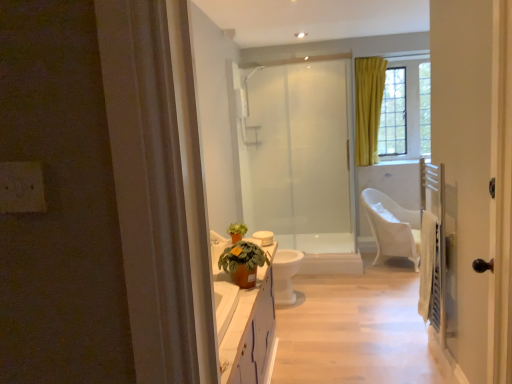
Describe the element at coordinates (475, 176) in the screenshot. I see `white glossy door at right` at that location.

The width and height of the screenshot is (512, 384). What do you see at coordinates (392, 227) in the screenshot? I see `white plastic chair at right` at bounding box center [392, 227].

This screenshot has height=384, width=512. Describe the element at coordinates (302, 161) in the screenshot. I see `frosted glass shower door at center` at that location.

Find the location of a particular element. Image resolution: width=512 pixels, height=384 pixels. white glossy door at right is located at coordinates (475, 176).

From the image's perspective, is yellow fabric curtain at upper right above terracotta clay pot at center?

Indeed, from the image's perspective, yellow fabric curtain at upper right is shown above terracotta clay pot at center.

In the scene shown: From a real-world perspective, between yellow fabric curtain at upper right and terracotta clay pot at center, who is vertically higher?

yellow fabric curtain at upper right, from a real-world perspective.

Which of these two, yellow fabric curtain at upper right or terracotta clay pot at center, is thinner?

With smaller width is yellow fabric curtain at upper right.

Is terracotta clay pot at center aimed at frosted glass shower door at center?

No, terracotta clay pot at center is not oriented towards frosted glass shower door at center.

Considering the sizes of objects terracotta clay pot at center and frosted glass shower door at center in the image provided, who is shorter, terracotta clay pot at center or frosted glass shower door at center?

With less height is terracotta clay pot at center.

Looking at this image, is there a large distance between terracotta clay pot at center and frosted glass shower door at center?

Yes.

From the image's perspective, between terracotta clay pot at center and frosted glass shower door at center, which one is located above?

frosted glass shower door at center is shown above in the image.

Based on the photo, is white glossy toilet bowl at center facing towards yellow fabric curtain at upper right?

No, white glossy toilet bowl at center is not oriented towards yellow fabric curtain at upper right.

Is white glossy toilet bowl at center far away from yellow fabric curtain at upper right?

Yes, white glossy toilet bowl at center is far from yellow fabric curtain at upper right.

Which is correct: white glossy toilet bowl at center is inside yellow fabric curtain at upper right, or outside of it?

The correct answer is: outside.

Considering the relative sizes of white glossy toilet bowl at center and yellow fabric curtain at upper right in the image provided, is white glossy toilet bowl at center wider than yellow fabric curtain at upper right?

Correct, the width of white glossy toilet bowl at center exceeds that of yellow fabric curtain at upper right.

From a real-world perspective, does white plastic chair at right sit lower than yellow fabric curtain at upper right?

Yes, from a real-world perspective, white plastic chair at right is below yellow fabric curtain at upper right.

In the scene shown: Is white plastic chair at right touching yellow fabric curtain at upper right?

white plastic chair at right and yellow fabric curtain at upper right are not in contact.

Can you confirm if white plastic chair at right is positioned to the right of yellow fabric curtain at upper right?

No.

Is frosted glass shower door at center taller than white plastic chair at right?

Yes.

From the image's perspective, which object appears higher, frosted glass shower door at center or white plastic chair at right?

frosted glass shower door at center appears higher in the image.

This screenshot has width=512, height=384. I want to click on screen door on the left of the white plastic chair at right, so click(302, 161).

Is white plastic chair at right a part of yellow fabric curtain at upper right?

That's incorrect, white plastic chair at right is not inside yellow fabric curtain at upper right.

The image size is (512, 384). Find the location of `chair below the yellow fabric curtain at upper right (from the image's perspective)`. chair below the yellow fabric curtain at upper right (from the image's perspective) is located at coordinates (392, 227).

Would you say yellow fabric curtain at upper right is to the left or to the right of white plastic chair at right in the picture?

yellow fabric curtain at upper right is positioned on white plastic chair at right's right side.

Between point (403, 244) and point (286, 264), which one is positioned behind?

The point (403, 244) is farther from the camera.

From the image's perspective, is white plastic chair at right above or below white glossy toilet bowl at center?

Clearly, from the image's perspective, white plastic chair at right is above white glossy toilet bowl at center.

Choose the correct answer: Is white plastic chair at right inside white glossy toilet bowl at center or outside it?

white plastic chair at right cannot be found inside white glossy toilet bowl at center.

Find the location of a particular element. window above the terracotta clay pot at center (from the image's perspective) is located at coordinates (406, 112).

You are a GUI agent. You are given a task and a screenshot of the screen. Output one action in this format:
    pyautogui.click(x=<x>, y=<y>)
    Task: Click on the houseplant that is on the left side of frosted glass shower door at center
    This screenshot has width=512, height=384.
    Given the screenshot: What is the action you would take?
    243,263

Which object lies further to the anchor point white glossy toilet bowl at center, frosted glass shower door at center or terracotta clay pot at center?

Among the two, terracotta clay pot at center is located further to white glossy toilet bowl at center.

Considering their positions, is frosted glass shower door at center positioned further to yellow fabric curtain at upper right than white glossy toilet bowl at center?

Based on the image, white glossy toilet bowl at center appears to be further to yellow fabric curtain at upper right.

Which object lies nearer to the anchor point white glossy toilet bowl at center, white glossy door at right or white plastic chair at right?

white plastic chair at right is positioned closer to the anchor white glossy toilet bowl at center.

Estimate the real-world distances between objects in this image. Which object is closer to white plastic chair at right, yellow fabric curtain at upper right or white glossy door at right?

yellow fabric curtain at upper right lies closer to white plastic chair at right than the other object.

From the image, which object appears to be farther from white glossy door at right, yellow fabric curtain at upper right or white plastic chair at right?

Based on the image, yellow fabric curtain at upper right appears to be further to white glossy door at right.

Which object lies further to the anchor point yellow fabric curtain at upper right, terracotta clay pot at center or frosted glass shower door at center?

The object further to yellow fabric curtain at upper right is terracotta clay pot at center.

Considering their positions, is white glossy toilet bowl at center positioned further to frosted glass shower door at center than white plastic chair at right?

Based on the image, white glossy toilet bowl at center appears to be further to frosted glass shower door at center.

Looking at the image, which one is located further to white glossy door at right, white glossy toilet bowl at center or terracotta clay pot at center?

The object further to white glossy door at right is white glossy toilet bowl at center.

Where is `chair between terracotta clay pot at center and yellow fabric curtain at upper right along the z-axis`? chair between terracotta clay pot at center and yellow fabric curtain at upper right along the z-axis is located at coordinates (392, 227).

The image size is (512, 384). I want to click on chair between white glossy door at right and yellow fabric curtain at upper right along the z-axis, so click(x=392, y=227).

Where is `toilet bowl between white glossy door at right and yellow fabric curtain at upper right from front to back`? toilet bowl between white glossy door at right and yellow fabric curtain at upper right from front to back is located at coordinates (285, 275).

At what (x,y) coordinates should I click in order to perform the action: click on chair between yellow fabric curtain at upper right and white glossy toilet bowl at center in the vertical direction. Please return your answer as a coordinate pair (x, y). This screenshot has width=512, height=384. Looking at the image, I should click on (392, 227).